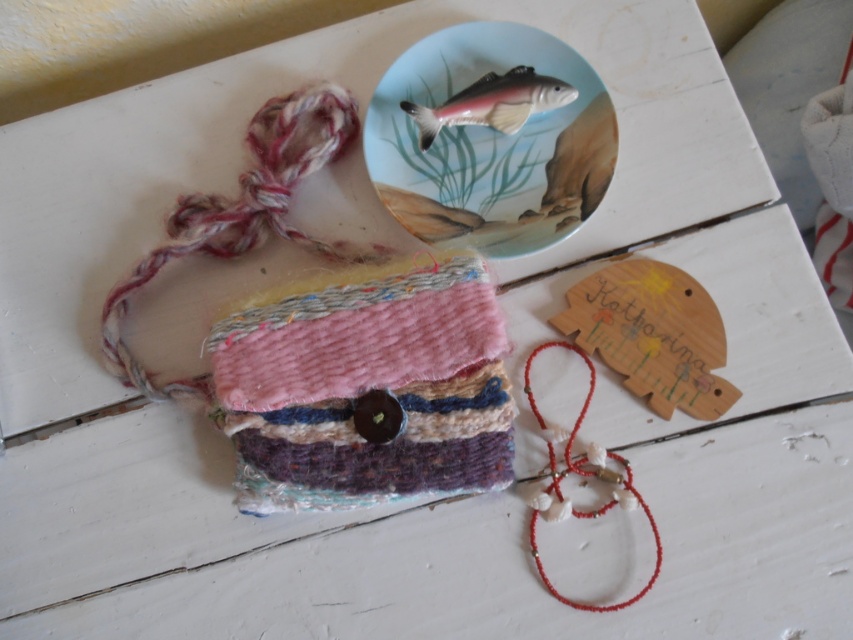
Which is in front, point (496, 410) or point (543, 346)?

Positioned in front is point (496, 410).

Does point (477, 435) come closer to viewer compared to point (660, 561)?

Yes, it is in front of point (660, 561).

Where is `textured wool pouch at center`? textured wool pouch at center is located at coordinates (367, 388).

From the picture: Which is below, textured wool pouch at center or porcelain fish plate at upper center?

Positioned lower is textured wool pouch at center.

Looking at this image, who is higher up, textured wool pouch at center or porcelain fish plate at upper center?

Positioned higher is porcelain fish plate at upper center.

Is point (418, 268) positioned before point (509, 205)?

That is True.

Find the location of a particular element. textured wool pouch at center is located at coordinates (367, 388).

Who is higher up, textured wool pouch at center or shiny metallic fish at upper center?

shiny metallic fish at upper center

Is textured wool pouch at center below shiny metallic fish at upper center?

Indeed, textured wool pouch at center is positioned under shiny metallic fish at upper center.

Between point (309, 378) and point (503, 116), which one is positioned behind?

The point (503, 116) is more distant.

Where is `textured wool pouch at center`? This screenshot has width=853, height=640. textured wool pouch at center is located at coordinates (367, 388).